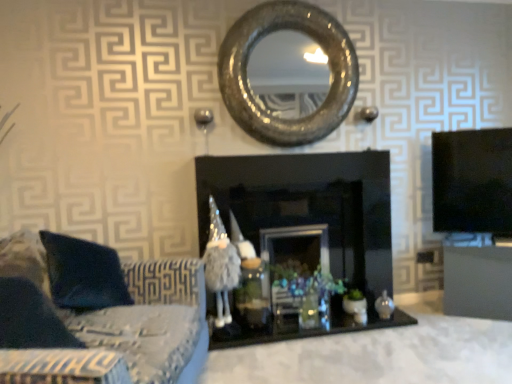
Image resolution: width=512 pixels, height=384 pixels. In order to click on free region under shiny metallic mirror at center (from a real-world perspective) in this screenshot , I will do `click(291, 150)`.